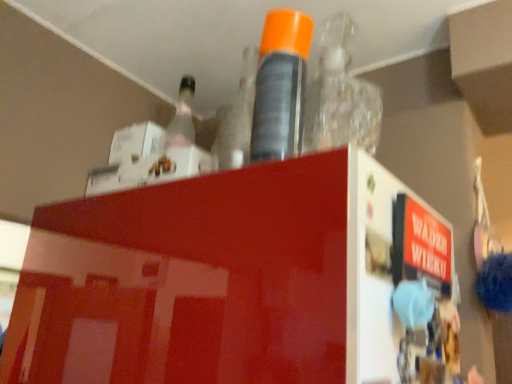
Question: Is orange cap spray can at center, which is the second bottle from right to left, bigger or smaller than transparent plastic bottle at upper center, which appears as the 3th bottle when viewed from the left?

Choices:
 (A) small
 (B) big

Answer: (A)

Question: Does point (302, 41) appear closer or farther from the camera than point (325, 79)?

Choices:
 (A) farther
 (B) closer

Answer: (B)

Question: Which object is the closest to the transparent plastic bottle at upper center, which is the first bottle in right-to-left order?

Choices:
 (A) clear plastic bottle at upper center, which is the first bottle from left to right
 (B) orange cap spray can at center, the second bottle positioned from the left

Answer: (B)

Question: Based on their relative distances, which object is nearer to the transparent plastic bottle at upper center, which appears as the 3th bottle when viewed from the left?

Choices:
 (A) clear plastic bottle at upper center, which is the first bottle from left to right
 (B) orange cap spray can at center, which is the second bottle from right to left

Answer: (B)